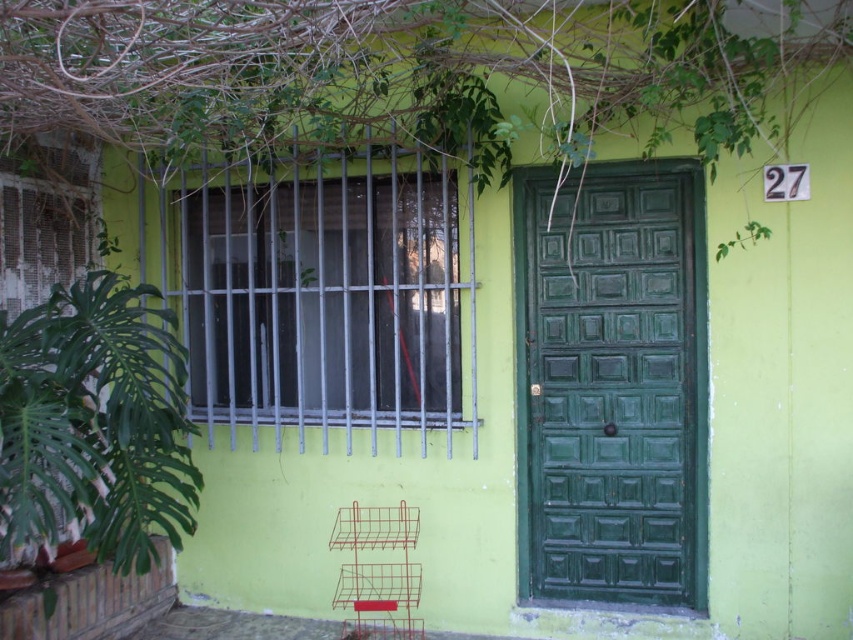
You are standing in front of the building and want to find the door. Which object at point (328,294) is not the door?

The metallic bars at center is located at point (328,294), so the object at that point is the metallic bars, not the door.

You are standing in front of the building and notice the green leafy plant at upper center and the metallic bars at center. Which object is positioned to the right side of the other?

The green leafy plant at upper center is to the right of the metallic bars at center.

You are standing in front of the building and want to hang a new wreath on the door. Which object, the green leafy plant at upper center or the metallic bars at center, is closer to the door?

The metallic bars at center are closer to the door because the green leafy plant at upper center is above the metallic bars at center, placing it farther away from the door.